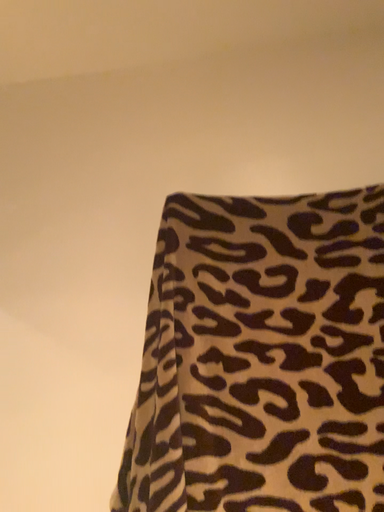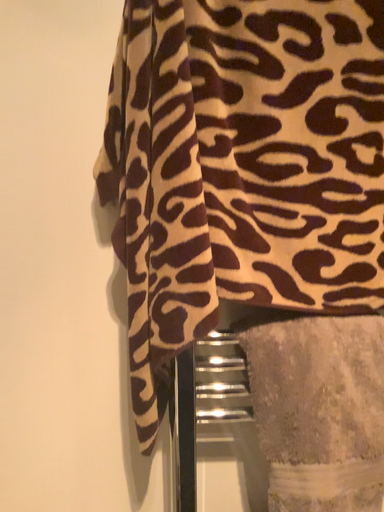
Question: Which way did the camera rotate in the video?

Choices:
 (A) rotated upward
 (B) rotated downward

Answer: (B)